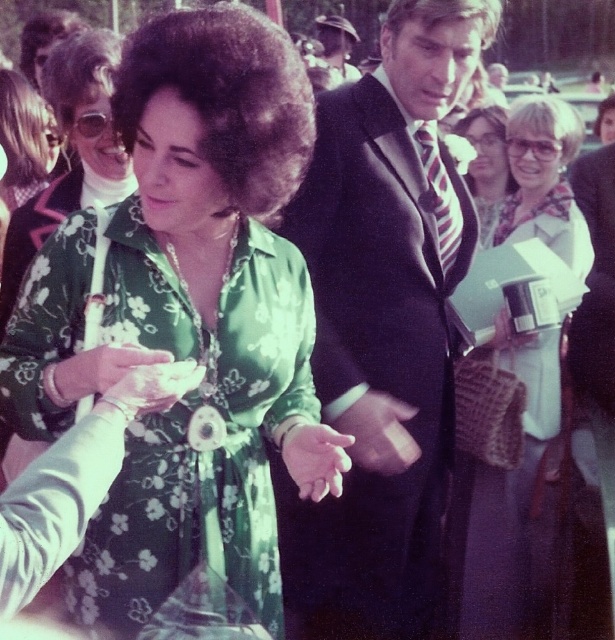
Question: Does dark suit at center appear over floral fabric dress at center?

Choices:
 (A) yes
 (B) no

Answer: (B)

Question: Which point appears closest to the camera in this image?

Choices:
 (A) (467, 536)
 (B) (132, 209)
 (C) (343, 547)

Answer: (B)

Question: Can you confirm if green floral fabric dress at center is bigger than floral fabric dress at center?

Choices:
 (A) yes
 (B) no

Answer: (B)

Question: Is white paper bag at center positioned behind matte black hair at upper right?

Choices:
 (A) yes
 (B) no

Answer: (B)

Question: Which is nearer to the dark suit at center?

Choices:
 (A) matte black suit at upper center
 (B) white paper bag at center
 (C) green floral fabric dress at center

Answer: (C)

Question: Which point is farther to the camera?

Choices:
 (A) (106, 144)
 (B) (558, 358)
 (C) (381, 461)

Answer: (B)